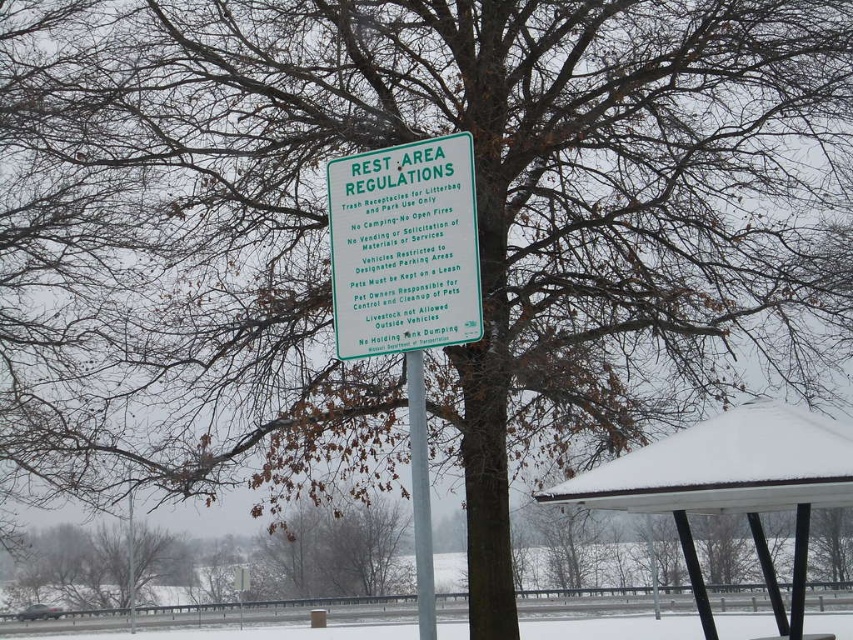
You are standing at the origin point of the coordinate system. Where is the green plastic sign at center located?

The green plastic sign at center is located at point (404, 248).

You are a visitor at the rest area and want to know if the green plastic sign at center is taller than the silver metallic pole at center. Can you tell me?

The green plastic sign at center is not as tall as the silver metallic pole at center.